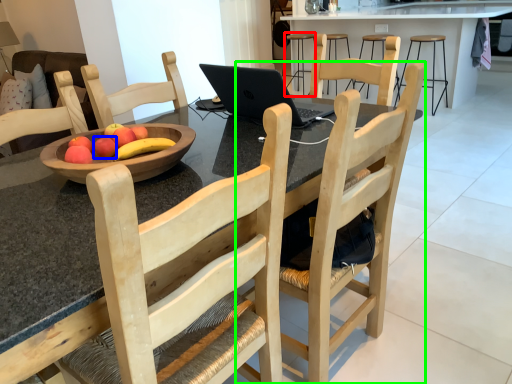
Question: Estimate the real-world distances between objects in this image. Which object is closer to bar stool (highlighted by a red box), apple (highlighted by a blue box) or chair (highlighted by a green box)?

Choices:
 (A) apple
 (B) chair

Answer: (B)